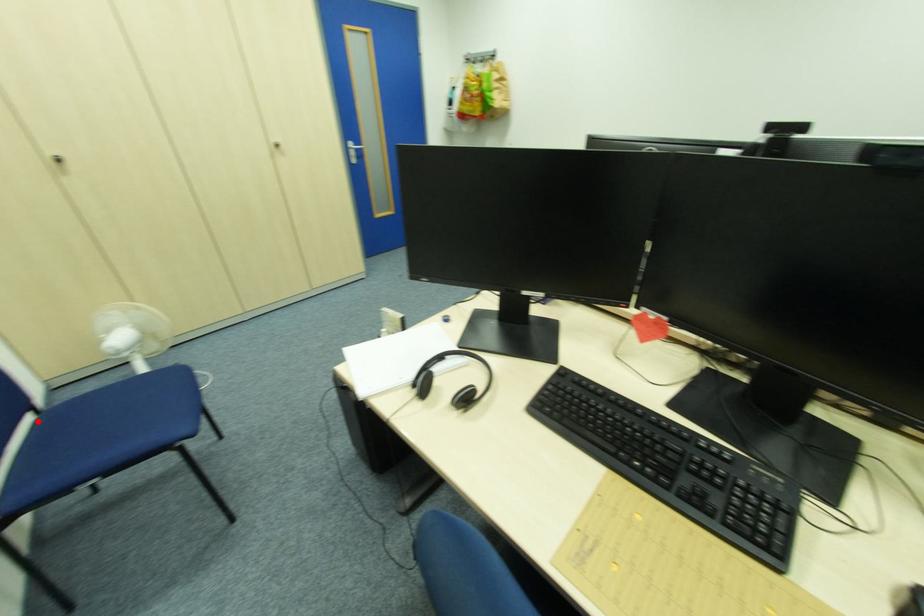
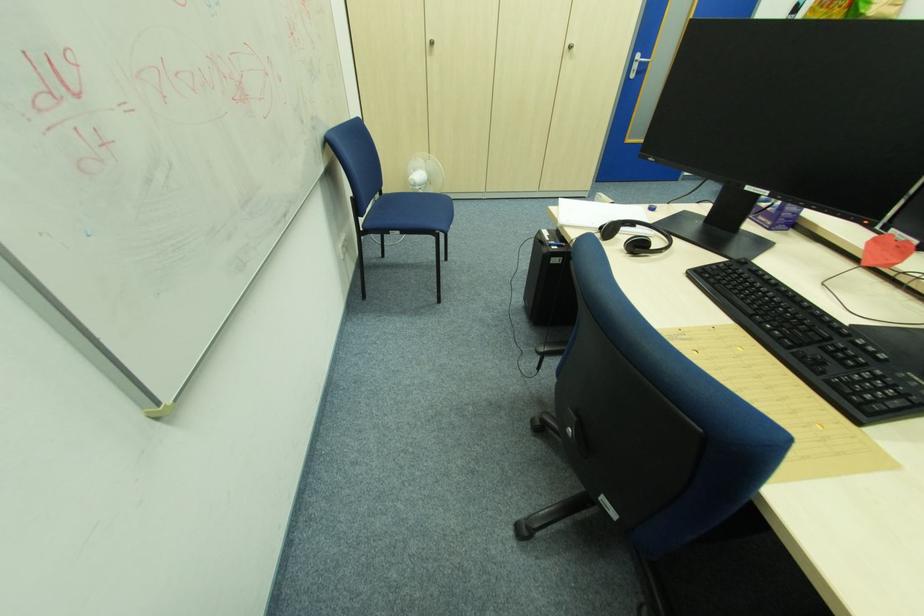
Question: A red point is marked in image1. In image2, is the corresponding 3D point closer to the camera or farther? Reply with the corresponding letter.

Choices:
 (A) The corresponding 3D point is closer.
 (B) The corresponding 3D point is farther.

Answer: (A)